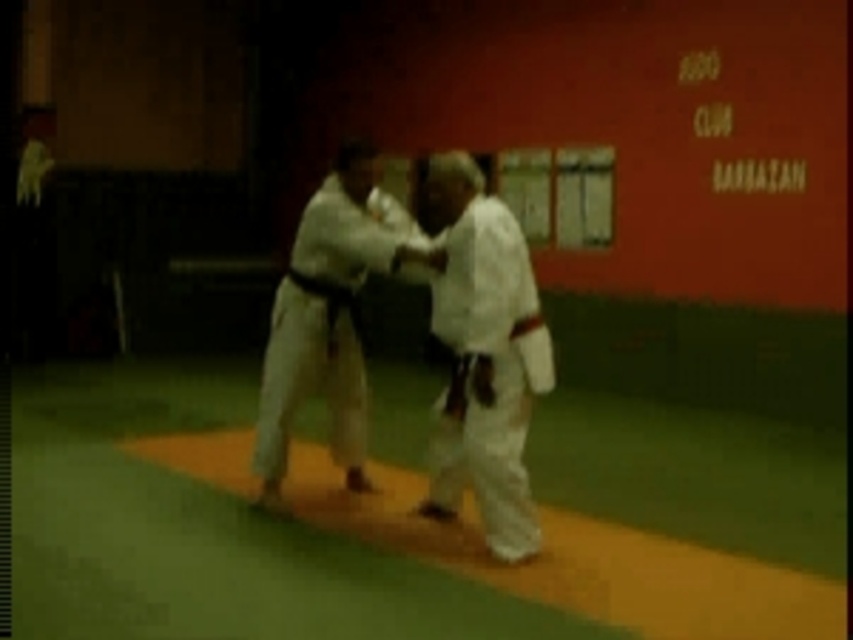
Question: Which of the following is the closest to the observer?

Choices:
 (A) (339, 408)
 (B) (483, 216)

Answer: (B)

Question: Does white cloth kimono at center appear on the left side of white karate gi at center?

Choices:
 (A) yes
 (B) no

Answer: (B)

Question: Which point appears closest to the camera in this image?

Choices:
 (A) (434, 264)
 (B) (531, 538)

Answer: (B)

Question: Can you confirm if white cloth kimono at center is positioned to the left of white karate gi at center?

Choices:
 (A) yes
 (B) no

Answer: (B)

Question: Can you confirm if white cloth kimono at center is positioned below white karate gi at center?

Choices:
 (A) yes
 (B) no

Answer: (B)